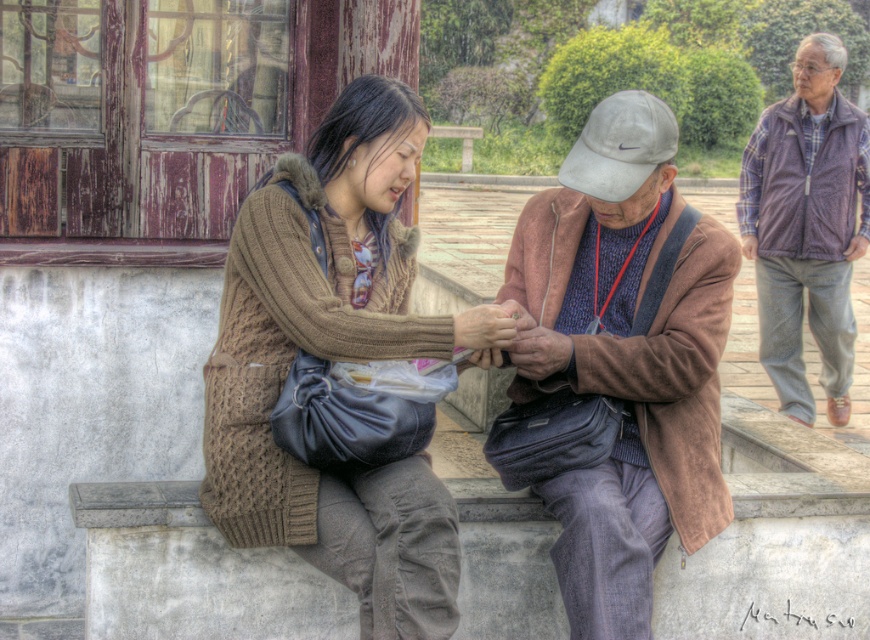
You are a photographer trying to capture a photo of the brown knitted sweater at center and the purple fleece vest at upper right. Which of the two items is wider in the image?

The brown knitted sweater at center is wider than the purple fleece vest at upper right according to the description.

In the scene shown: You are a tailor measuring garments for alterations. You need to determine which garment, the brown suede jacket at center or the purple fleece vest at upper right, requires a wider alteration to accommodate a larger frame. Based on the scene, which one should you prioritize?

The brown suede jacket at center requires a wider alteration because its width is larger than the purple fleece vest at upper right.